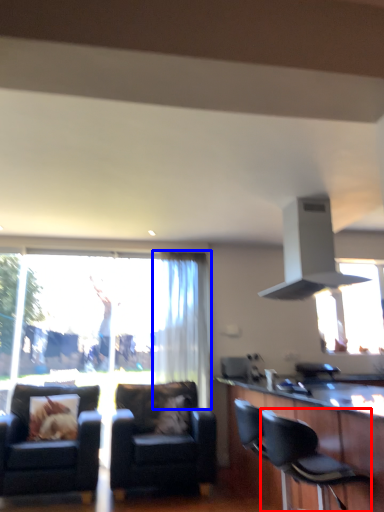
Question: Which point is further to the camera, chair (highlighted by a red box) or curtain (highlighted by a blue box)?

Choices:
 (A) chair
 (B) curtain

Answer: (B)